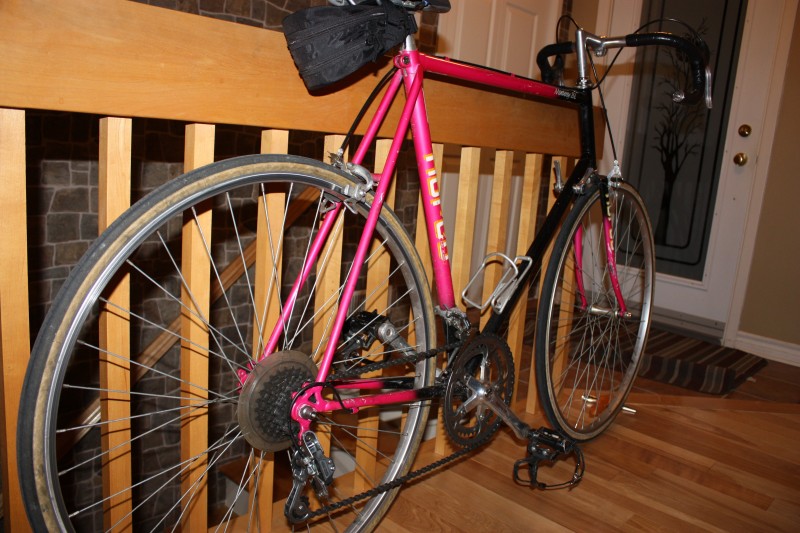
Locate an element on the screen. The width and height of the screenshot is (800, 533). panels on door is located at coordinates (522, 48), (516, 185), (450, 33).